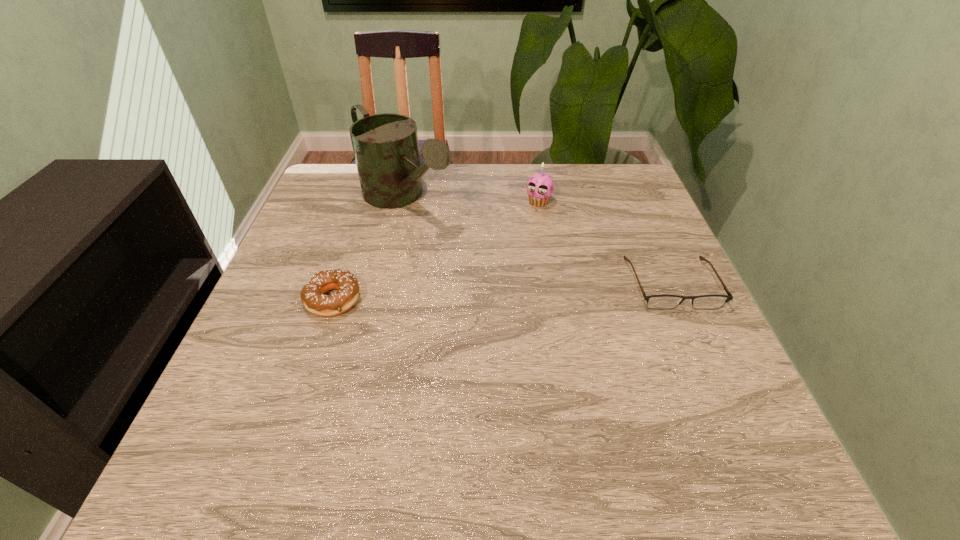
The height and width of the screenshot is (540, 960). I want to click on doughnut, so click(x=312, y=296).

At what (x,y) coordinates should I click in order to perform the action: click on the shortest object. Please return your answer as a coordinate pair (x, y). The width and height of the screenshot is (960, 540). Looking at the image, I should click on (661, 302).

Locate an element on the screen. The width and height of the screenshot is (960, 540). the rightmost object is located at coordinates (661, 302).

Identify the location of watering can. The height and width of the screenshot is (540, 960). (385, 146).

Where is `cupcake`? cupcake is located at coordinates (540, 186).

Find the location of a particular element. The image size is (960, 540). the third shortest object is located at coordinates (540, 186).

Where is `vacant point located on the right of the doughnut`? vacant point located on the right of the doughnut is located at coordinates (456, 299).

The image size is (960, 540). Identify the location of vacant space located on the front-facing side of the rightmost object. (731, 416).

You are a GUI agent. You are given a task and a screenshot of the screen. Output one action in this format:
    pyautogui.click(x=<x>, y=<y>)
    Task: Click on the free space located 0.110m with the spout on the tallest object
    
    Given the screenshot: What is the action you would take?
    pyautogui.click(x=461, y=249)

At what (x,y) coordinates should I click in order to perform the action: click on vacant position located 0.250m with the spout on the tallest object. Please return your answer as a coordinate pair (x, y). Looking at the image, I should click on (500, 280).